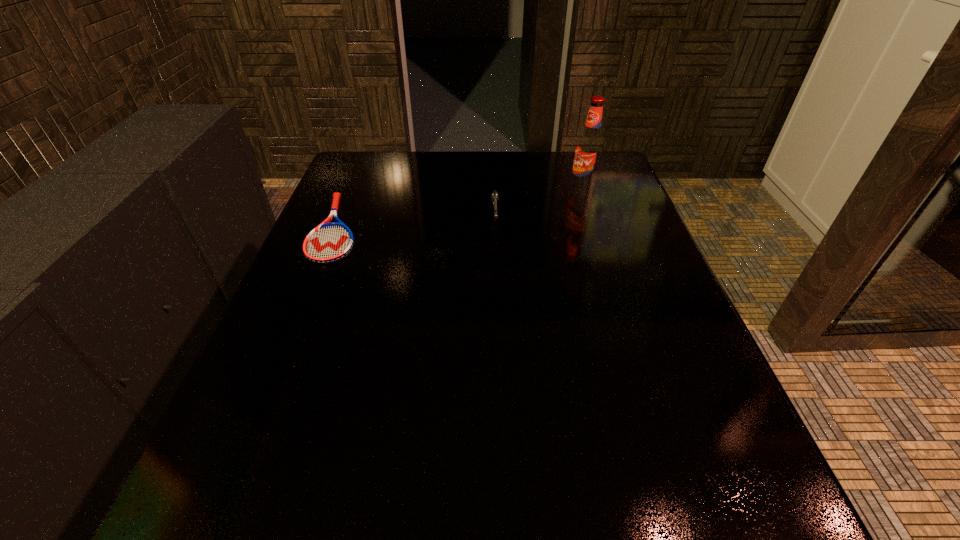
Choose which object is the nearest neighbor to the root beer. Please provide its 2D coordinates. Your answer should be formatted as a tuple, i.e. [(x, y)], where the tuple contains the x and y coordinates of a point satisfying the conditions above.

[(494, 195)]

Point out which object is positioned as the second nearest to the tallest object. Please provide its 2D coordinates. Your answer should be formatted as a tuple, i.e. [(x, y)], where the tuple contains the x and y coordinates of a point satisfying the conditions above.

[(329, 242)]

Locate an element on the screen. This screenshot has width=960, height=540. vacant space that satisfies the following two spatial constraints: 1. on the back side of the tennis racket; 2. on the left side of the tallest object is located at coordinates (353, 188).

At what (x,y) coordinates should I click in order to perform the action: click on blank space that satisfies the following two spatial constraints: 1. on the back side of the root beer; 2. on the right side of the shortest object. Please return your answer as a coordinate pair (x, y). Looking at the image, I should click on (353, 188).

Find the location of `vacant point that satisfies the following two spatial constraints: 1. on the back side of the rightmost object; 2. on the right side of the leftmost object`. vacant point that satisfies the following two spatial constraints: 1. on the back side of the rightmost object; 2. on the right side of the leftmost object is located at coordinates (353, 188).